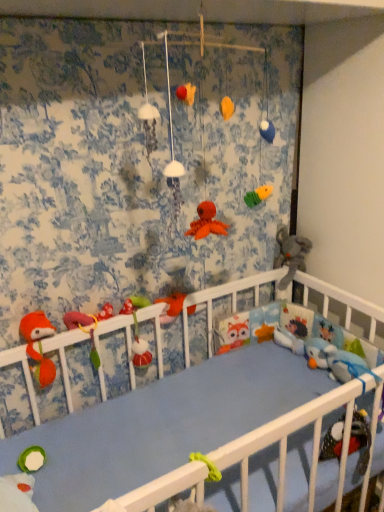
Question: Is fluffy orange fox at left, placed as the 1th toy when sorted from left to right, at the back of blue plush toy at right, the 2th toy positioned from the right?

Choices:
 (A) no
 (B) yes

Answer: (A)

Question: Is blue plush toy at right, the fifth toy when ordered from left to right, directly adjacent to fluffy orange fox at left, which ranks as the 6th toy in right-to-left order?

Choices:
 (A) yes
 (B) no

Answer: (B)

Question: Can you confirm if blue plush toy at right, the fifth toy when ordered from left to right, is bigger than fluffy orange fox at left, placed as the 1th toy when sorted from left to right?

Choices:
 (A) yes
 (B) no

Answer: (B)

Question: Does blue plush toy at right, the fifth toy when ordered from left to right, have a greater height compared to fluffy orange fox at left, which ranks as the 6th toy in right-to-left order?

Choices:
 (A) no
 (B) yes

Answer: (A)

Question: Is blue plush toy at right, the fifth toy when ordered from left to right, not near fluffy orange fox at left, placed as the 1th toy when sorted from left to right?

Choices:
 (A) no
 (B) yes

Answer: (A)

Question: Looking at their shapes, would you say blue plush toy at right, the fifth toy when ordered from left to right, is wider or thinner than fluffy orange fox at left, which ranks as the 6th toy in right-to-left order?

Choices:
 (A) wide
 (B) thin

Answer: (A)

Question: In terms of size, does blue plush toy at right, the fifth toy when ordered from left to right, appear bigger or smaller than fluffy orange fox at left, which ranks as the 6th toy in right-to-left order?

Choices:
 (A) small
 (B) big

Answer: (A)

Question: Which is correct: blue plush toy at right, the 2th toy positioned from the right, is inside fluffy orange fox at left, placed as the 1th toy when sorted from left to right, or outside of it?

Choices:
 (A) outside
 (B) inside

Answer: (A)

Question: Is blue plush toy at right, the 2th toy positioned from the right, taller or shorter than fluffy orange fox at left, which ranks as the 6th toy in right-to-left order?

Choices:
 (A) tall
 (B) short

Answer: (B)

Question: Does point (299, 257) appear closer or farther from the camera than point (167, 297)?

Choices:
 (A) closer
 (B) farther

Answer: (B)

Question: Considering the positions of gray plush elephant at right, the 1th toy when ordered from right to left, and matte orange plush at center, which ranks as the third toy in right-to-left order, in the image, is gray plush elephant at right, the 1th toy when ordered from right to left, wider or thinner than matte orange plush at center, which ranks as the third toy in right-to-left order,?

Choices:
 (A) wide
 (B) thin

Answer: (A)

Question: From their relative heights in the image, would you say gray plush elephant at right, the 1th toy when ordered from right to left, is taller or shorter than matte orange plush at center, which is counted as the fourth toy, starting from the left?

Choices:
 (A) tall
 (B) short

Answer: (A)

Question: Considering their positions, is gray plush elephant at right, the 1th toy when ordered from right to left, located in front of or behind matte orange plush at center, which ranks as the third toy in right-to-left order?

Choices:
 (A) behind
 (B) front

Answer: (A)

Question: Considering the positions of fluffy orange fox at left, which ranks as the 6th toy in right-to-left order, and gray plush elephant at right, positioned as the 6th toy in left-to-right order, in the image, is fluffy orange fox at left, which ranks as the 6th toy in right-to-left order, bigger or smaller than gray plush elephant at right, positioned as the 6th toy in left-to-right order,?

Choices:
 (A) big
 (B) small

Answer: (B)

Question: From a real-world perspective, is fluffy orange fox at left, placed as the 1th toy when sorted from left to right, positioned above or below gray plush elephant at right, positioned as the 6th toy in left-to-right order?

Choices:
 (A) above
 (B) below

Answer: (B)